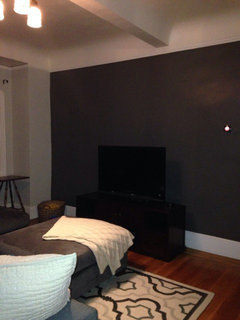
This screenshot has height=320, width=240. I want to click on small table, so click(10, 179).